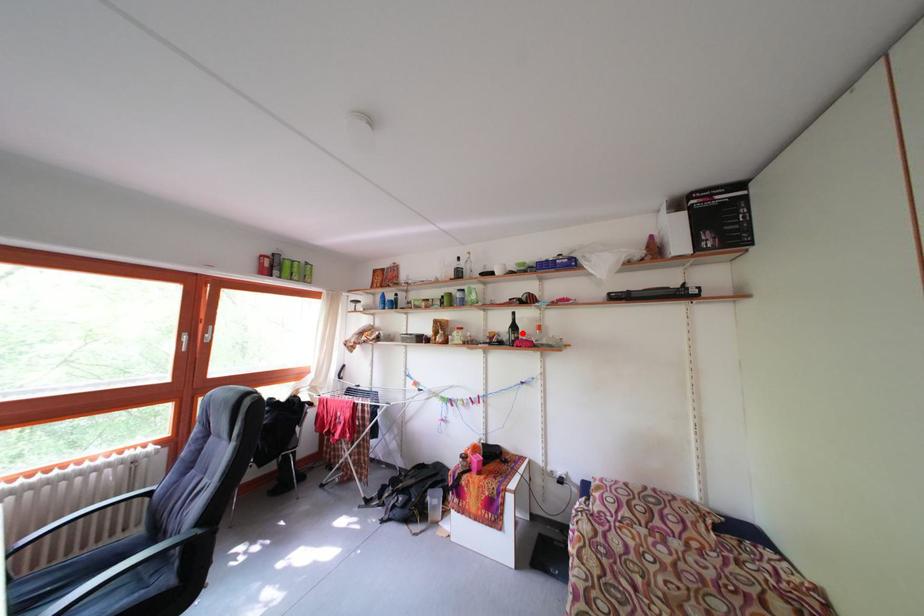
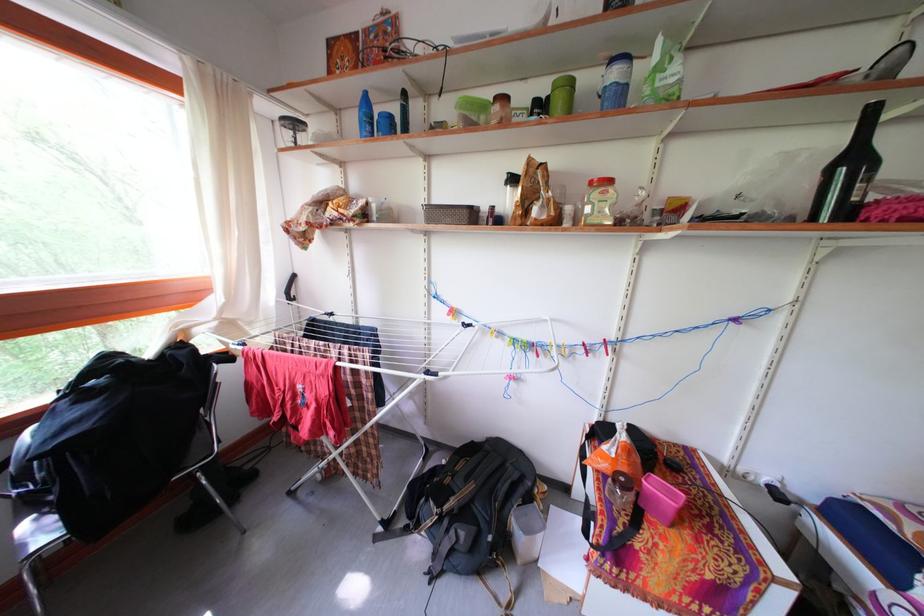
Where in the second image is the point corresponding to the highlighted location from the first image?

(861, 166)